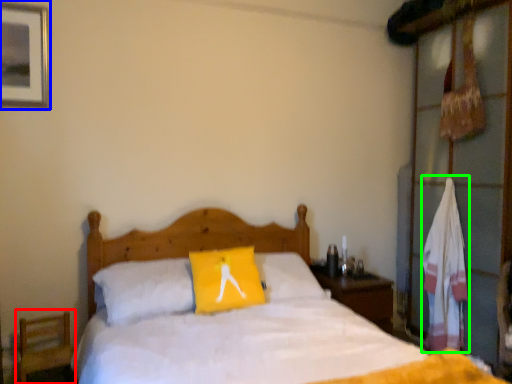
Question: Which object is positioned closest to armchair (highlighted by a red box)? Select from picture frame (highlighted by a blue box) and material (highlighted by a green box).

Choices:
 (A) picture frame
 (B) material

Answer: (A)